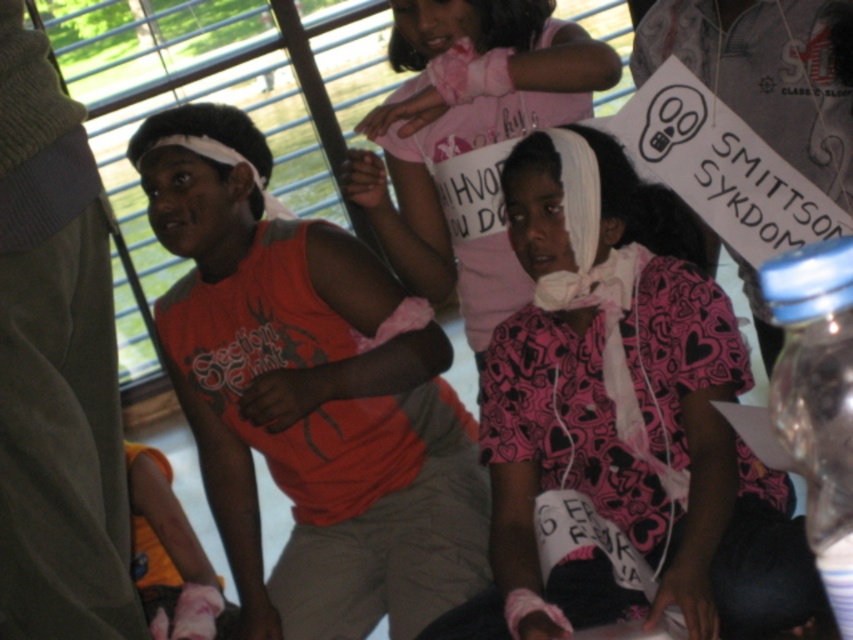
Question: Which point appears closest to the camera in this image?

Choices:
 (A) click(x=763, y=284)
 (B) click(x=222, y=378)

Answer: (A)

Question: Which point is closer to the camera taking this photo?

Choices:
 (A) (792, 257)
 (B) (718, 484)
 (C) (245, 513)
 (D) (374, 163)

Answer: (B)

Question: Observing the image, what is the correct spatial positioning of orange matte shirt at center in reference to white bandage at center?

Choices:
 (A) above
 (B) below

Answer: (B)

Question: Which of the following is the closest to the observer?

Choices:
 (A) (268, 397)
 (B) (599, 356)
 (C) (780, 276)

Answer: (C)

Question: Where is orange matte shirt at center located in relation to transparent plastic bottle at right in the image?

Choices:
 (A) above
 (B) below

Answer: (A)

Question: Observing the image, what is the correct spatial positioning of pink fabric bandage at center in reference to orange matte shirt at center?

Choices:
 (A) left
 (B) right

Answer: (B)